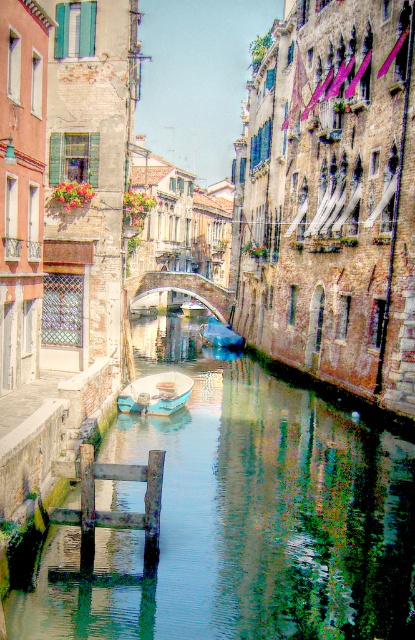
Between point (154, 403) and point (209, 323), which one is positioned behind?

The point (209, 323) is behind.

Does blue painted wooden boat at center have a greater width compared to white plastic boat at center?

Yes.

Find the location of `blue painted wooden boat at center`. blue painted wooden boat at center is located at coordinates (156, 394).

This screenshot has width=415, height=640. What do you see at coordinates (183, 291) in the screenshot?
I see `stone arch bridge at center` at bounding box center [183, 291].

Is point (175, 284) more distant than point (197, 314)?

No, it is not.

Find the location of `stone arch bridge at center`. stone arch bridge at center is located at coordinates (183, 291).

Between greenish water at center and white plastic boat at center, which one appears on the right side from the viewer's perspective?

white plastic boat at center is more to the right.

Is greenish water at center to the right of white plastic boat at center from the viewer's perspective?

In fact, greenish water at center is to the left of white plastic boat at center.

Find the location of `greenish water at center`. greenish water at center is located at coordinates (248, 515).